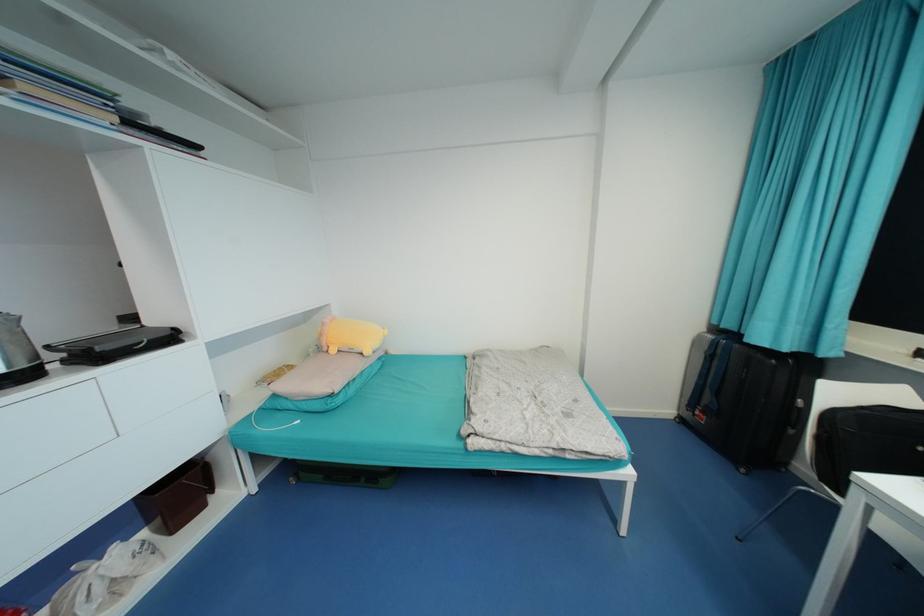
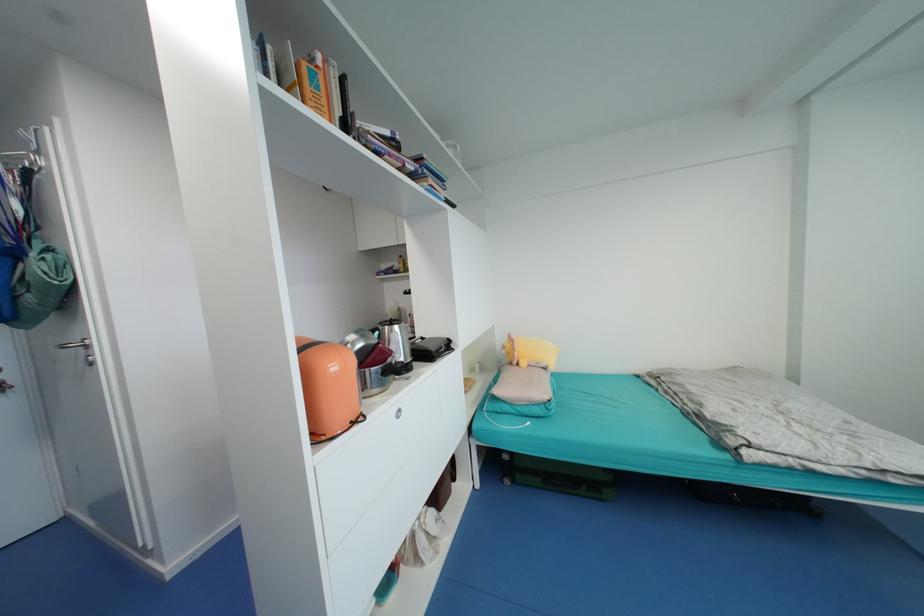
The point at [337,351] is marked in the first image. Where is the corresponding point in the second image?

(529, 365)